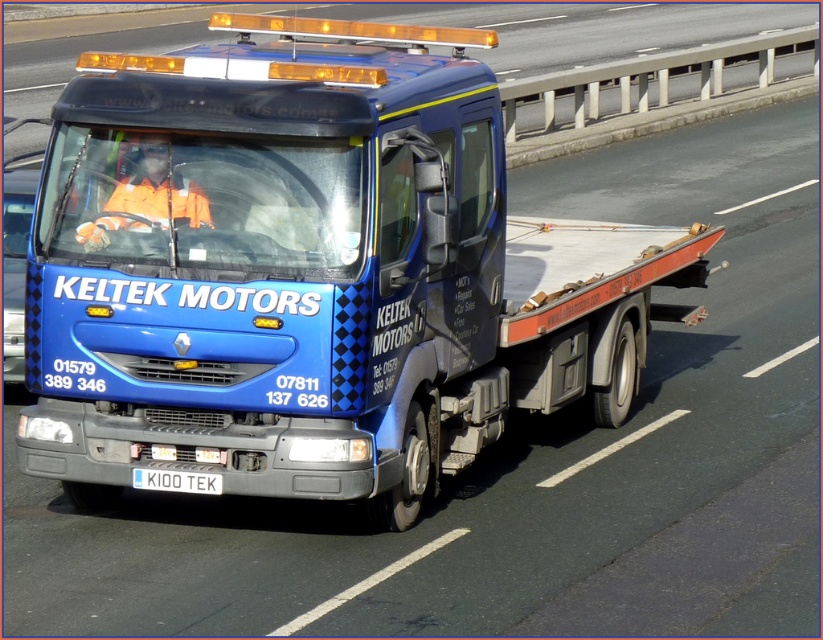
You are a driver who needs to tow a car. You see the blue metallic tow truck at center and the white plastic license plate at center. Which one is closer to you?

The blue metallic tow truck at center is positioned over white plastic license plate at center, so the blue metallic tow truck at center is closer to you.

You are a delivery driver who needs to position your vehicle exactly where the blue metallic tow truck at center is currently located. What are the coordinates you should aim for?

The blue metallic tow truck at center is located at coordinates (312, 272). You should aim for those coordinates to position your vehicle there.

You are a traffic officer assessing the width of vehicles on a narrow bridge. You observe a blue metallic tow truck at center and a white plastic license plate at center. Which object is wider?

The blue metallic tow truck at center is wider than the white plastic license plate at center according to the description.